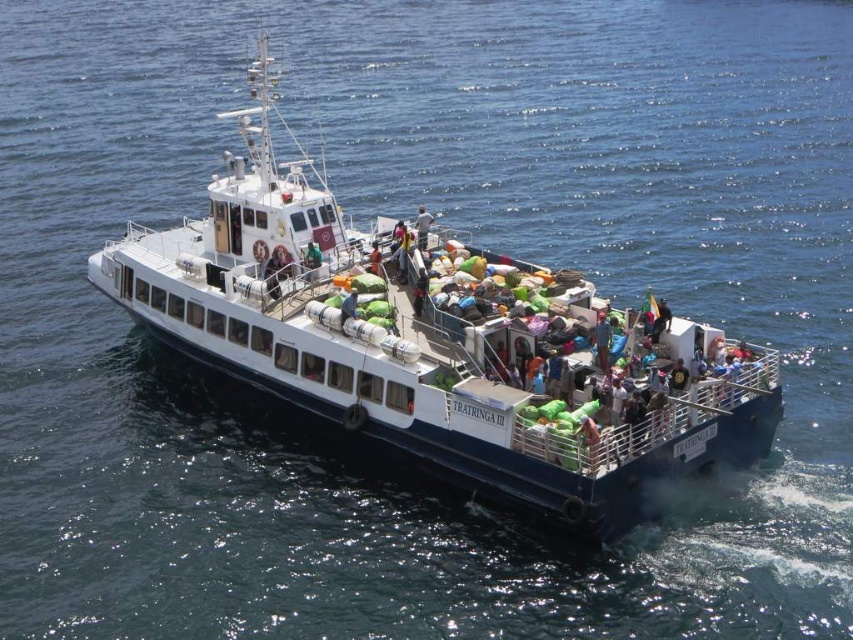
Question: Is white matte boat at center thinner than light brown wooden chair at center?

Choices:
 (A) yes
 (B) no

Answer: (B)

Question: Among these points, which one is farthest from the camera?

Choices:
 (A) (589, 308)
 (B) (421, 243)

Answer: (B)

Question: Can you confirm if white matte boat at center is smaller than light brown wooden chair at center?

Choices:
 (A) yes
 (B) no

Answer: (B)

Question: Which point is farther to the camera?

Choices:
 (A) (421, 243)
 (B) (463, 449)

Answer: (A)

Question: Considering the relative positions of white matte boat at center and light brown wooden chair at center in the image provided, where is white matte boat at center located with respect to light brown wooden chair at center?

Choices:
 (A) above
 (B) below

Answer: (A)

Question: Among these objects, which one is farthest from the camera?

Choices:
 (A) light brown wooden chair at center
 (B) white matte boat at center

Answer: (A)